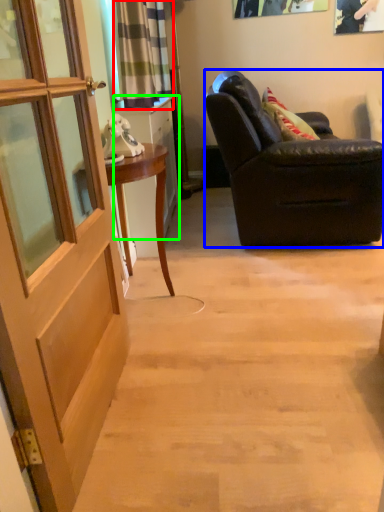
Question: Estimate the real-world distances between objects in this image. Which object is closer to curtain (highlighted by a red box), chair (highlighted by a blue box) or cabinetry (highlighted by a green box)?

Choices:
 (A) chair
 (B) cabinetry

Answer: (B)